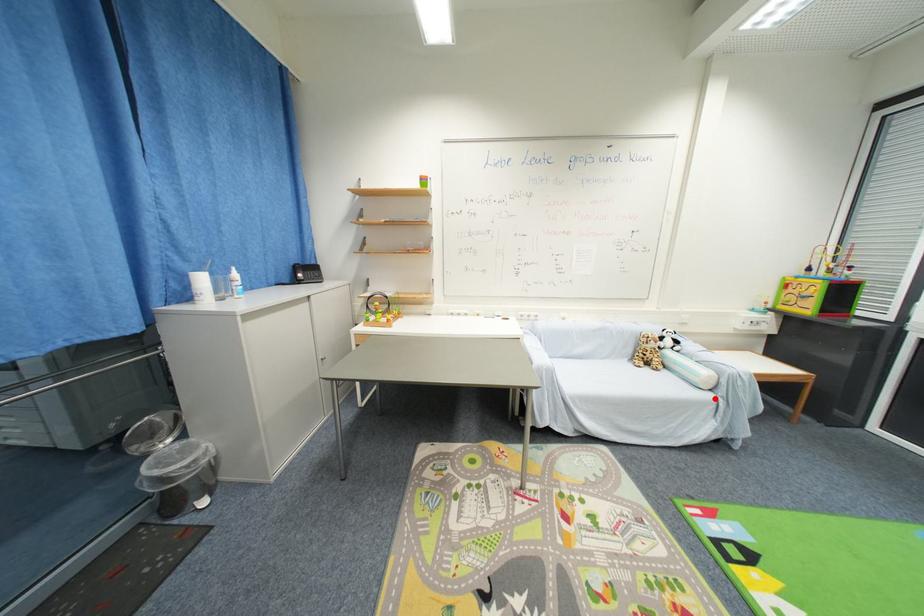
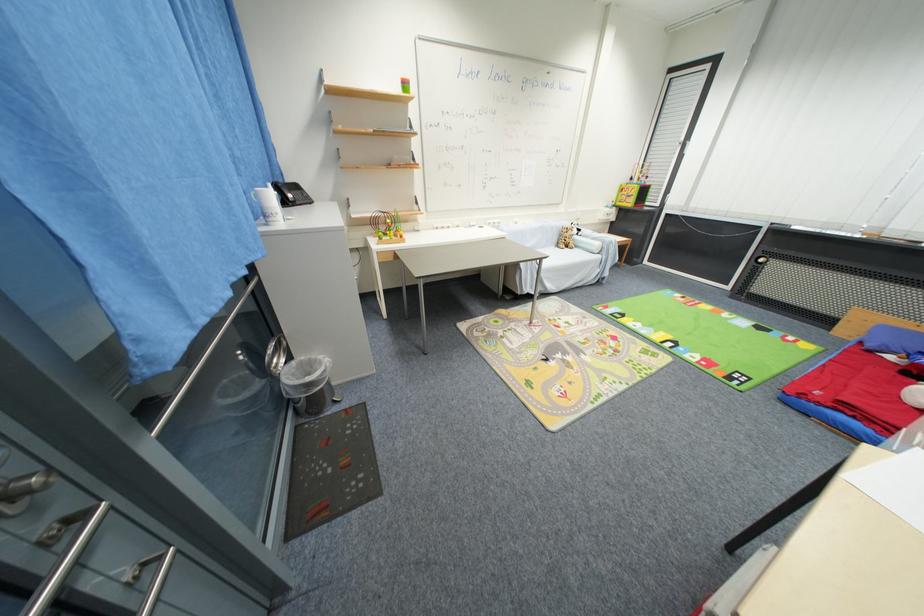
The point at the highlighted location is marked in the first image. Where is the corresponding point in the second image?

(603, 259)